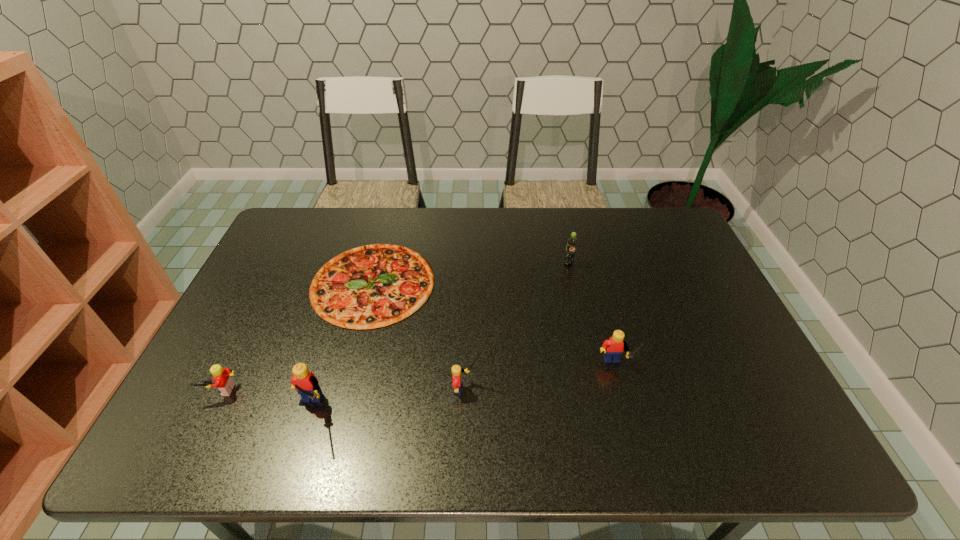
Choose which object is the fourth nearest neighbor to the second Lego from right to left. Please provide its 2D coordinates. Your answer should be formatted as a tuple, i.e. [(x, y)], where the tuple contains the x and y coordinates of a point satisfying the conditions above.

[(572, 242)]

Point out which object is positioned as the third nearest to the second object from right to left. Please provide its 2D coordinates. Your answer should be formatted as a tuple, i.e. [(x, y)], where the tuple contains the x and y coordinates of a point satisfying the conditions above.

[(456, 369)]

Identify which Lego is the nearest to the pizza. Please provide its 2D coordinates. Your answer should be formatted as a tuple, i.e. [(x, y)], where the tuple contains the x and y coordinates of a point satisfying the conditions above.

[(456, 369)]

What are the coordinates of `Lego that stands as the third closest to the fifth shortest object` in the screenshot? It's located at (x=222, y=380).

Locate an element on the screen. The height and width of the screenshot is (540, 960). vacant position in the image that satisfies the following two spatial constraints: 1. on the front-facing side of the second Lego from right to left; 2. in front of the leftmost object with the accessory visible is located at coordinates (468, 390).